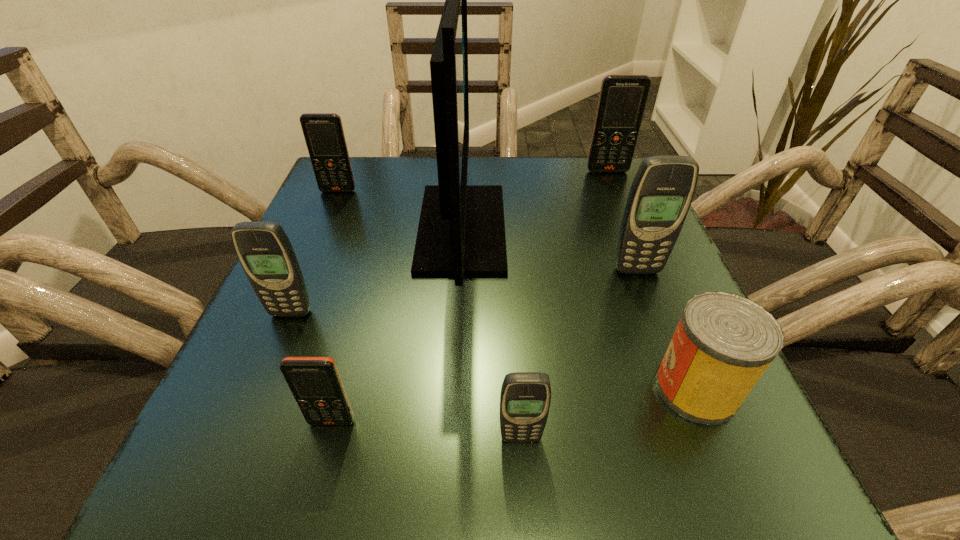
Where is `can`? The height and width of the screenshot is (540, 960). can is located at coordinates (724, 342).

Where is `the fourth cellular telephone from right to left`? the fourth cellular telephone from right to left is located at coordinates (315, 383).

Locate an element on the screen. The image size is (960, 540). the third object from left to right is located at coordinates (315, 383).

Where is `the nearest object`? This screenshot has height=540, width=960. the nearest object is located at coordinates (525, 398).

Locate an element on the screen. the second gray cellular telephone from left to right is located at coordinates (525, 398).

Locate an element on the screen. free space located on the screen side of the monitor is located at coordinates coord(652,228).

Find the location of a particular element. free region located on the screen of the rightmost orange cellular telephone is located at coordinates (655, 284).

This screenshot has width=960, height=540. Identify the location of free space located on the screen of the biggest gray cellular telephone. (710, 460).

Where is `vacant space located 0.070m on the screen of the second nearest gray cellular telephone`? This screenshot has width=960, height=540. vacant space located 0.070m on the screen of the second nearest gray cellular telephone is located at coordinates (275, 352).

The image size is (960, 540). In order to click on free space located on the screen of the second smallest orange cellular telephone in this screenshot , I will do `click(323, 228)`.